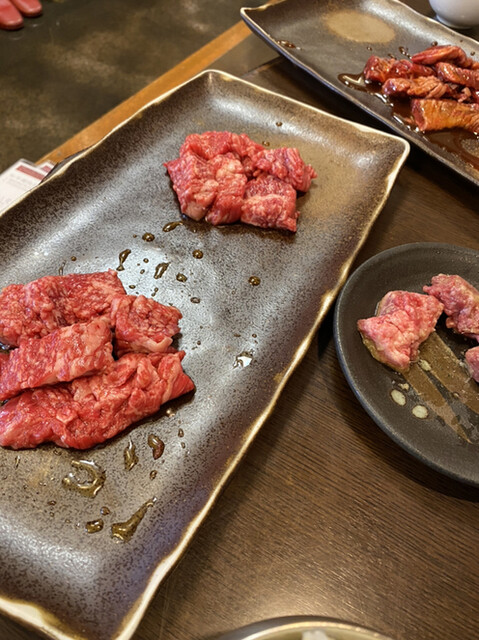
Locate an element on the screen. Image resolution: width=479 pixels, height=640 pixels. wood table is located at coordinates (321, 544).